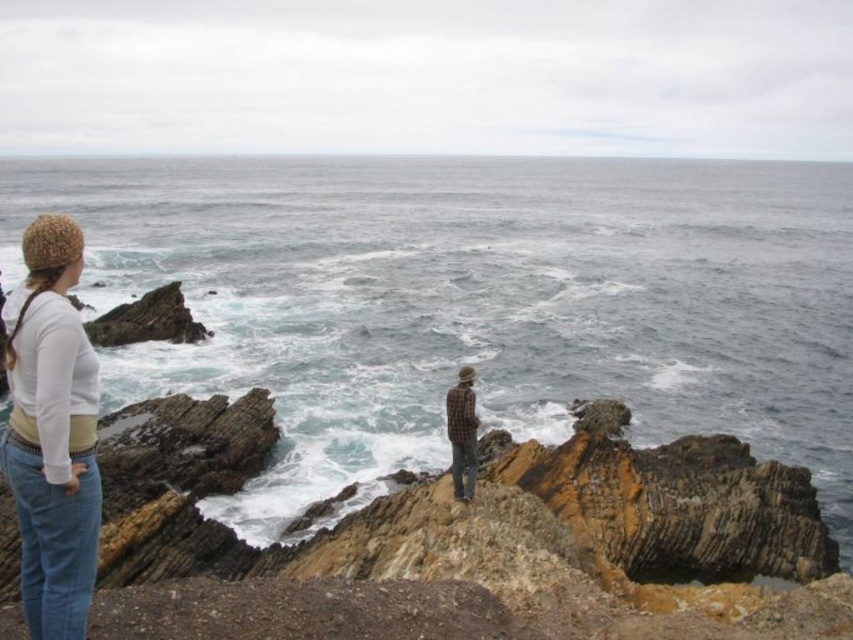
In the scene shown: You are a photographer trying to capture both the dark blue water at center and the matte white sweater at left in the same frame. Which object should you focus on first to ensure both are in focus?

The dark blue water at center is closer to the viewer than the matte white sweater at left. To ensure both are in focus, you should focus on the matte white sweater at left, which is farther away, as focusing on the farther object can help include the closer one within the depth of field.

You are a photographer planning to take a photo of the dark blue water at center. The camera you are using requires you to input the exact 2D coordinates to focus on. What are the coordinates you should enter into the camera?

The coordinates for the dark blue water at center are at point (x=473, y=301).

You are a photographer planning to capture a landscape shot of the dark blue water at center and the matte white sweater at left. Based on their widths, which object should you prioritize framing first to ensure it fits within the shot?

The dark blue water at center has a greater width than the matte white sweater at left, so you should prioritize framing the dark blue water at center first to ensure it fits within the shot.